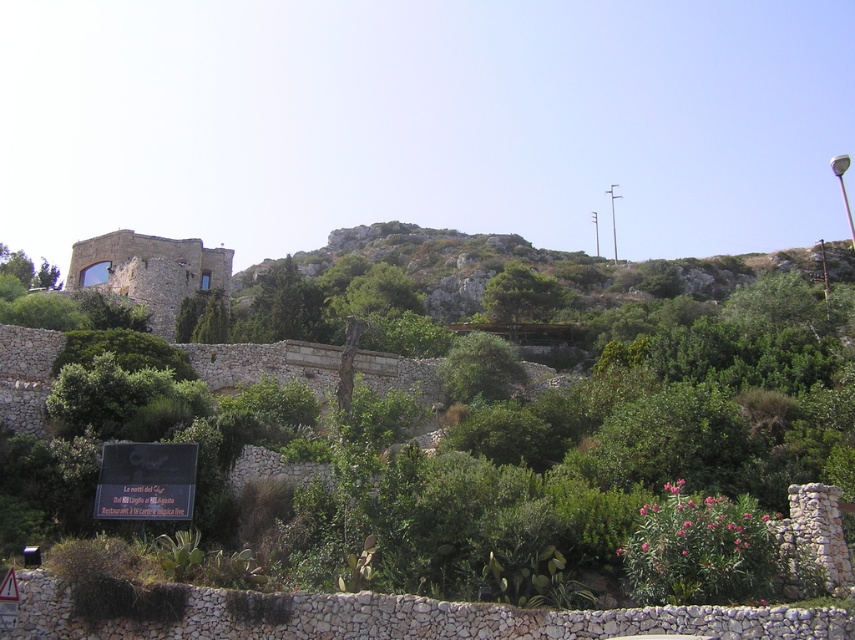
Question: Is rockymaterial/texturehillside at upper center above black matte sign at lower left?

Choices:
 (A) yes
 (B) no

Answer: (A)

Question: Which point is farther to the camera?

Choices:
 (A) black matte sign at lower left
 (B) green leafy tree at upper center
 (C) rockymaterial/texturehillside at upper center

Answer: (C)

Question: Which of the following is the closest to the observer?

Choices:
 (A) (538, 291)
 (B) (168, 506)

Answer: (B)

Question: Does rockymaterial/texturehillside at upper center have a larger size compared to green leafy bush at center?

Choices:
 (A) yes
 (B) no

Answer: (A)

Question: Is rockymaterial/texturehillside at upper center below black matte sign at lower left?

Choices:
 (A) yes
 (B) no

Answer: (B)

Question: Which is nearer to the rustic stone castle at center-left?

Choices:
 (A) rockymaterial/texturehillside at upper center
 (B) green leafy tree at upper left
 (C) green leafy bush at center
 (D) black matte sign at lower left

Answer: (B)